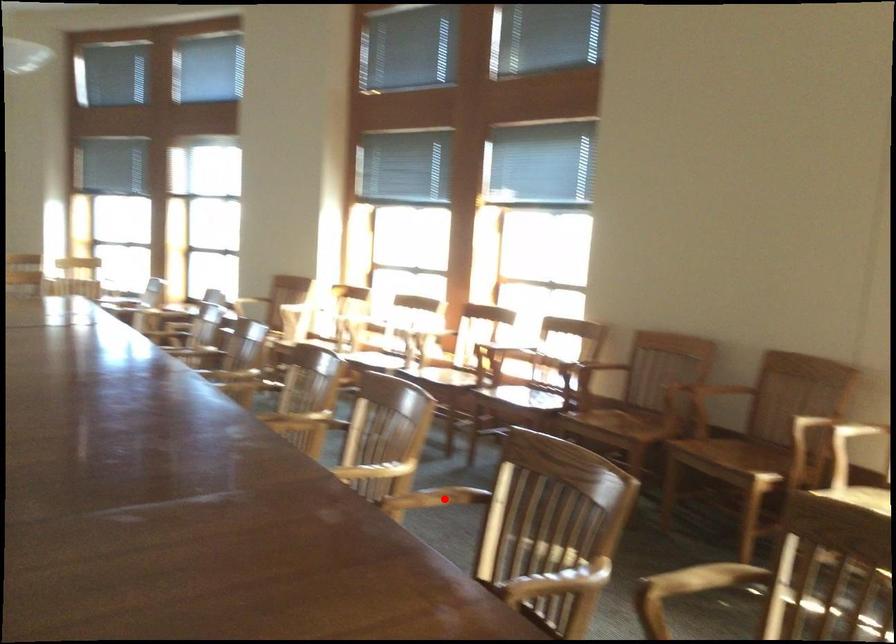
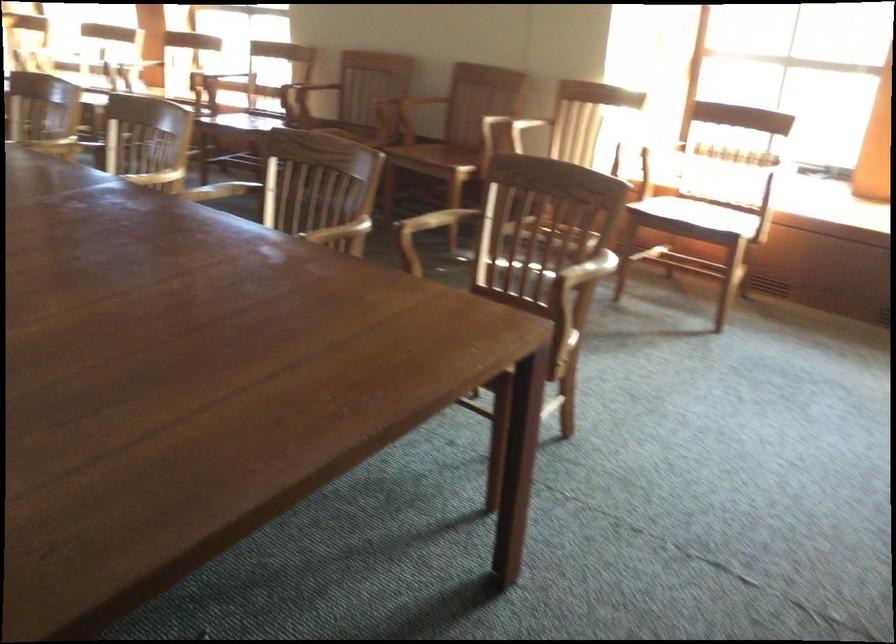
Find the pixel in the second image that matches the highlighted location in the first image.

(219, 190)